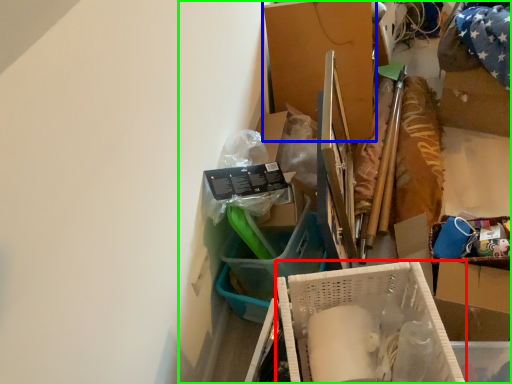
Question: Based on their relative distances, which object is farther from box (highlighted by a red box)? Choose from box (highlighted by a blue box) and collection (highlighted by a green box).

Choices:
 (A) box
 (B) collection

Answer: (A)